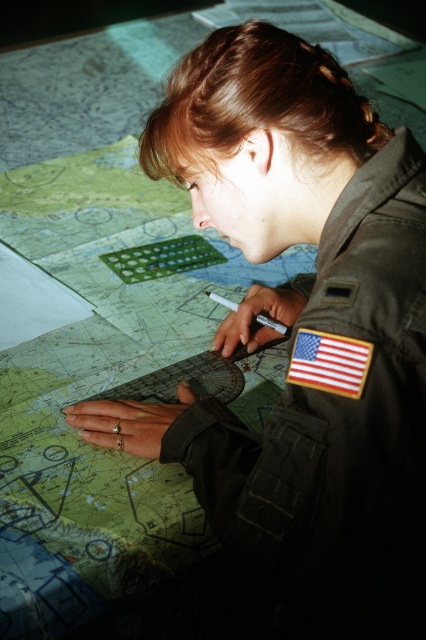
Can you confirm if brown hair at upper center is bigger than american flag patch at upper center?

Yes.

Does point (294, 134) come farther from viewer compared to point (294, 384)?

Yes, it is.

Find the location of a particular element. brown hair at upper center is located at coordinates (334, 108).

At what (x,y) coordinates should I click in order to perform the action: click on brown hair at upper center. Please return your answer as a coordinate pair (x, y). Looking at the image, I should click on (334, 108).